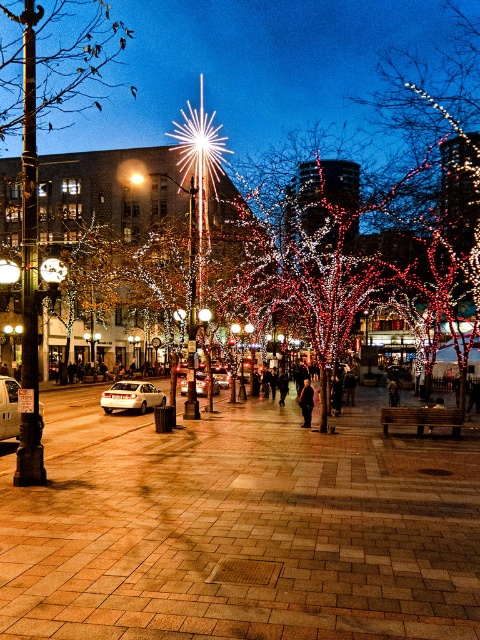
Does point (121, 509) come in front of point (310, 404)?

Yes, it is.

This screenshot has height=640, width=480. In order to click on brick pavement at center in this screenshot , I will do `click(240, 529)`.